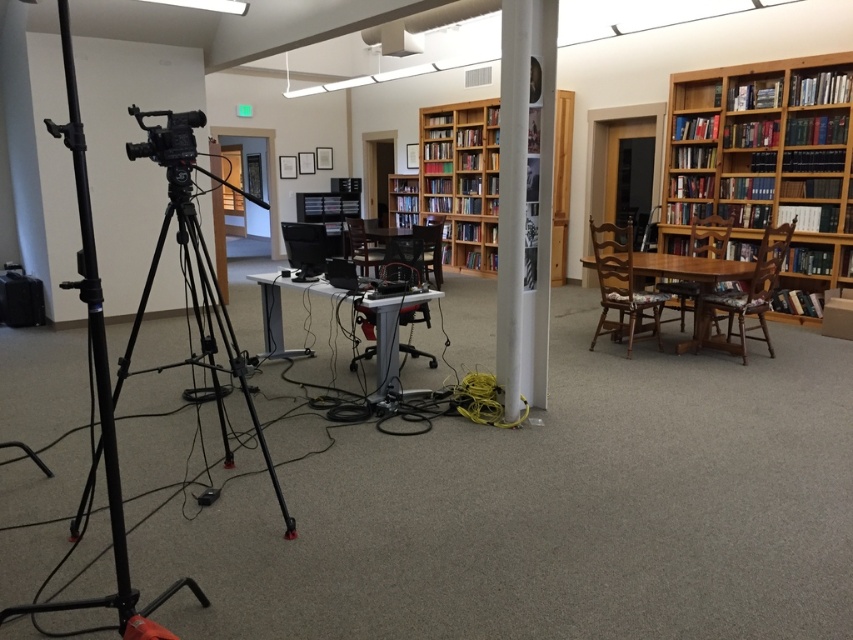
Question: Does wooden bookshelf at center appear on the right side of matte black video camera at left?

Choices:
 (A) no
 (B) yes

Answer: (B)

Question: Estimate the real-world distances between objects in this image. Which object is closer to the matte black video camera at left?

Choices:
 (A) black matte tripod at left
 (B) wooden bookshelf at center
 (C) wooden bookcase at right

Answer: (A)

Question: Which object is positioned closest to the black matte tripod at left?

Choices:
 (A) wooden bookcase at right
 (B) wooden bookshelf at center
 (C) matte black video camera at left

Answer: (C)

Question: Can you confirm if black matte tripod at left is positioned to the left of matte black video camera at left?

Choices:
 (A) yes
 (B) no

Answer: (A)

Question: Based on their relative distances, which object is farther from the wooden bookcase at right?

Choices:
 (A) wooden bookshelf at center
 (B) black matte tripod at left
 (C) matte black video camera at left

Answer: (C)

Question: Can you confirm if wooden bookcase at right is wider than black matte tripod at left?

Choices:
 (A) yes
 (B) no

Answer: (B)